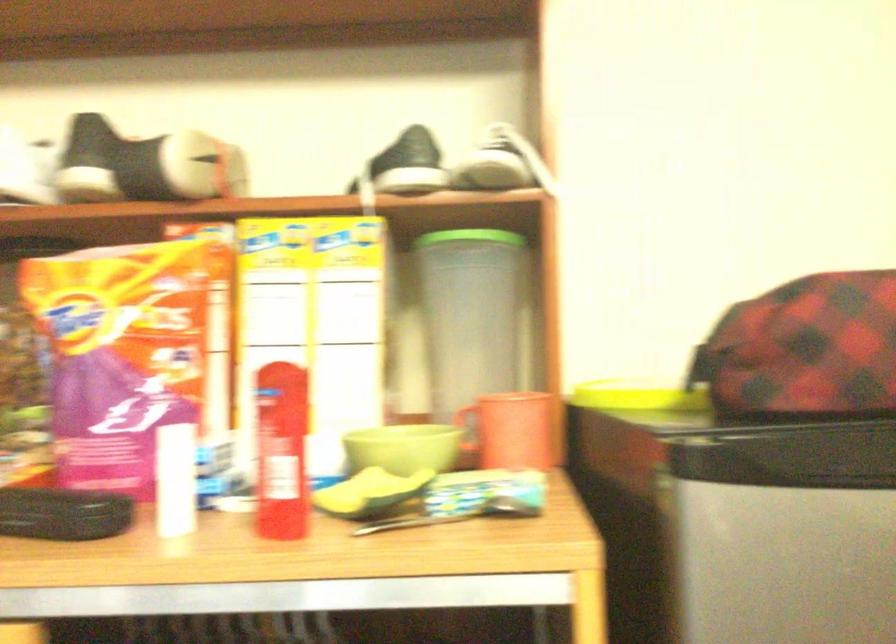
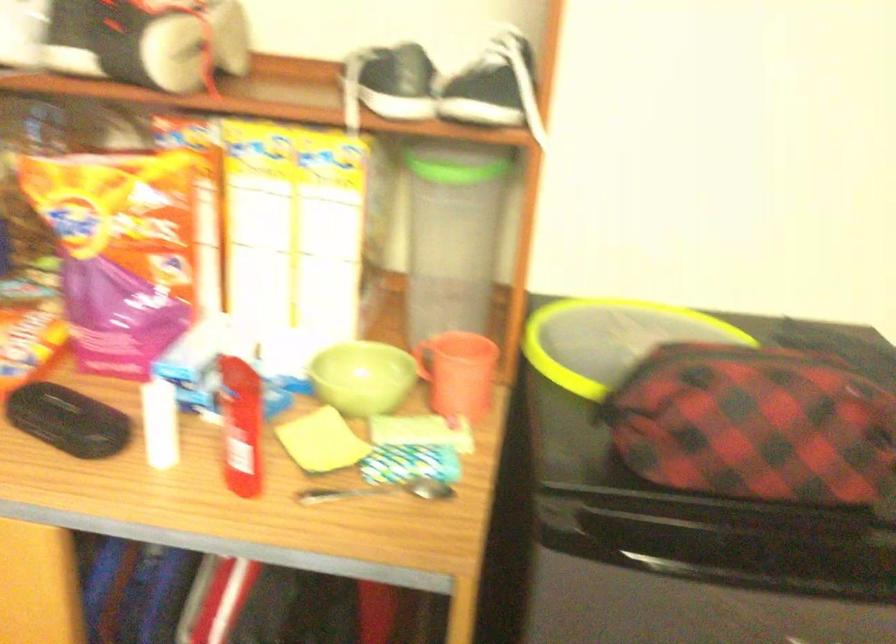
Question: Which direction would the cameraman need to move to produce the second image? Reply with the corresponding letter.

Choices:
 (A) Left
 (B) Right
 (C) Forward
 (D) Backward

Answer: (B)